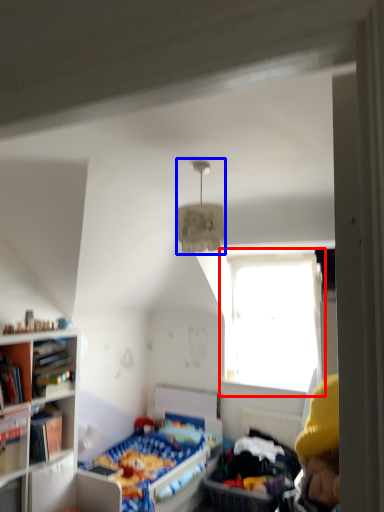
Question: Which object appears farthest to the camera in this image, window (highlighted by a red box) or light fixture (highlighted by a blue box)?

Choices:
 (A) window
 (B) light fixture

Answer: (A)